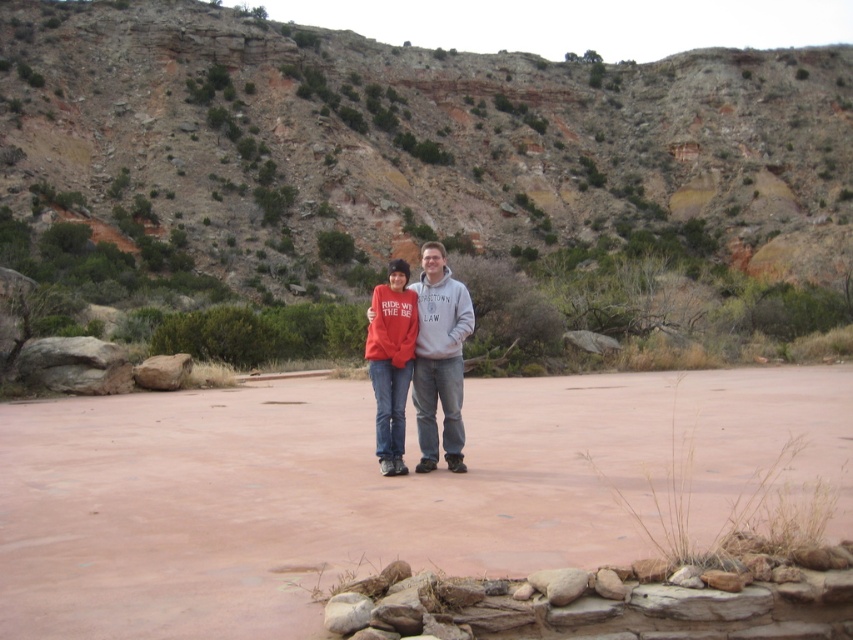
Question: Is dull brown rock at center bigger than matte red sweatshirt at center?

Choices:
 (A) yes
 (B) no

Answer: (A)

Question: Does dull brown rock at center have a larger size compared to reddish-brown dirt field at center?

Choices:
 (A) yes
 (B) no

Answer: (A)

Question: Among these points, which one is nearest to the camera?

Choices:
 (A) (277, 605)
 (B) (430, 268)
 (C) (393, 438)

Answer: (A)

Question: Estimate the real-world distances between objects in this image. Which object is closer to the reddish-brown dirt field at center?

Choices:
 (A) matte red sweatshirt at center
 (B) matte red hoodie at center

Answer: (A)

Question: Among these objects, which one is farthest from the camera?

Choices:
 (A) matte red hoodie at center
 (B) dull brown rock at center

Answer: (B)

Question: Does dull brown rock at center appear over matte red sweatshirt at center?

Choices:
 (A) yes
 (B) no

Answer: (A)